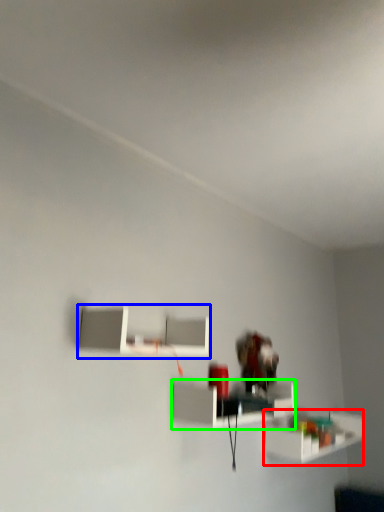
Question: Which object is positioned closest to shelf (highlighted by a red box)? Select from shelf (highlighted by a blue box) and shelf (highlighted by a green box).

Choices:
 (A) shelf
 (B) shelf

Answer: (B)